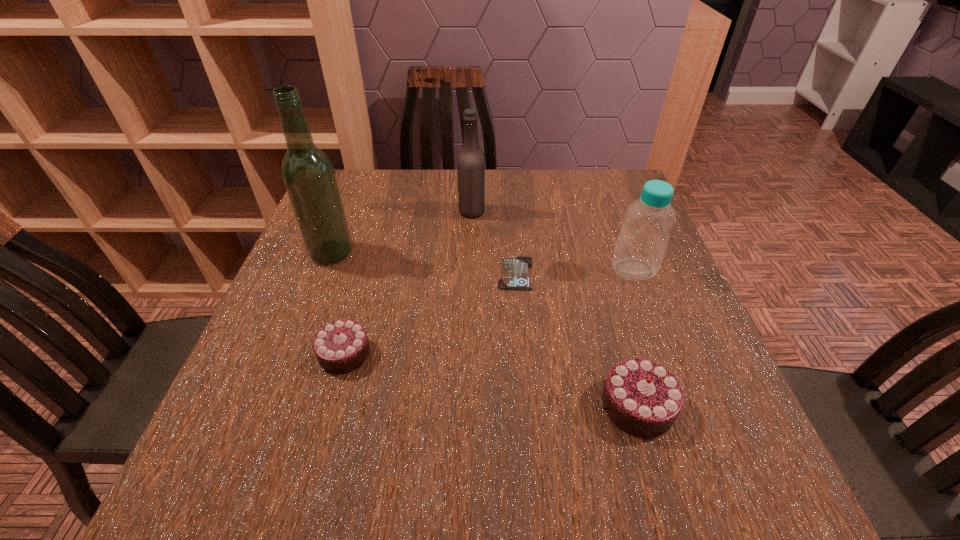
Find the location of a particular element. This screenshot has height=540, width=960. free space located on the left of the second nearest object is located at coordinates (293, 353).

Identify the location of free spot located on the right of the nearer chocolate cake. (726, 406).

This screenshot has height=540, width=960. What are the coordinates of `free spot located on the label of the third object from left to right` in the screenshot? It's located at (632, 212).

This screenshot has height=540, width=960. I want to click on free space located 0.140m on the left of the fourth shortest object, so click(x=550, y=270).

Where is `free spot located 0.390m on the front of the tallest object`? free spot located 0.390m on the front of the tallest object is located at coordinates (268, 419).

This screenshot has height=540, width=960. Find the location of `free region located 0.090m on the left of the fourth object from left to right`. free region located 0.090m on the left of the fourth object from left to right is located at coordinates (459, 273).

The width and height of the screenshot is (960, 540). I want to click on object located at the far edge, so click(x=471, y=162).

Find the location of `object that is at the near edge`. object that is at the near edge is located at coordinates (642, 398).

Where is `chocolate cake present at the left edge`? The width and height of the screenshot is (960, 540). chocolate cake present at the left edge is located at coordinates (340, 347).

Where is `liquor present at the left edge`? This screenshot has width=960, height=540. liquor present at the left edge is located at coordinates (308, 174).